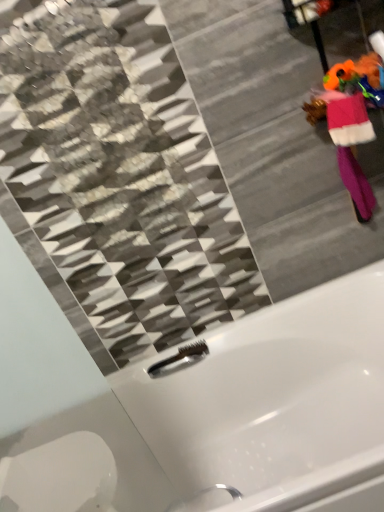
Question: From a real-world perspective, is white glossy bathtub at center physically located above or below pink fuzzy robe at right?

Choices:
 (A) above
 (B) below

Answer: (B)

Question: Is point (334, 309) positioned closer to the camera than point (347, 122)?

Choices:
 (A) closer
 (B) farther

Answer: (B)

Question: Which object is positioned farthest from the brushed metal faucet at lower center?

Choices:
 (A) white glossy bathtub at center
 (B) pink fuzzy robe at right

Answer: (B)

Question: Which is farther from the pink fuzzy robe at right?

Choices:
 (A) brushed metal faucet at lower center
 (B) white glossy bathtub at center

Answer: (A)